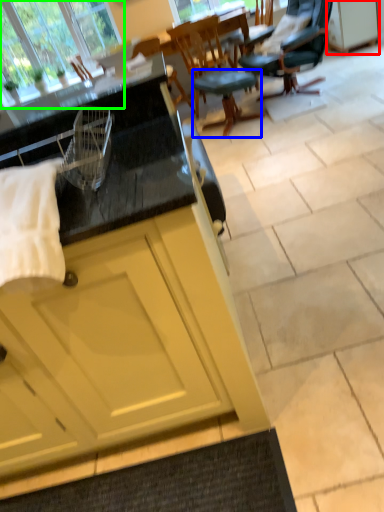
Question: Which object is positioned farthest from cabinetry (highlighted by a red box)? Select from stool (highlighted by a blue box) and window (highlighted by a green box).

Choices:
 (A) stool
 (B) window

Answer: (B)